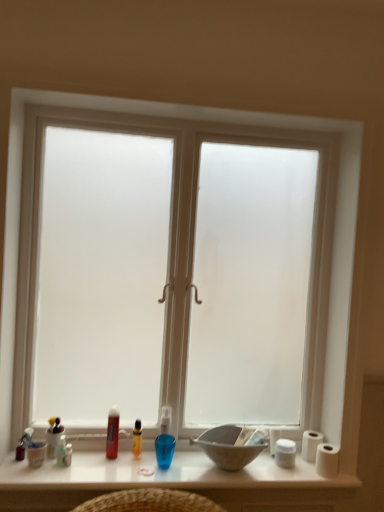
Question: Is matte white cup at lower left, placed as the 2th toiletry when sorted from left to right, completely or partially outside of white matte toilet paper at right, the first toilet paper positioned from the front?

Choices:
 (A) no
 (B) yes

Answer: (B)

Question: Is matte white cup at lower left, the 4th toiletry viewed from the right, not near white matte toilet paper at right, the first toilet paper positioned from the front?

Choices:
 (A) yes
 (B) no

Answer: (A)

Question: Is matte white cup at lower left, the 4th toiletry viewed from the right, facing away from white matte toilet paper at right, placed as the second toilet paper when sorted from back to front?

Choices:
 (A) yes
 (B) no

Answer: (B)

Question: Are matte white cup at lower left, the 4th toiletry viewed from the right, and white matte toilet paper at right, the first toilet paper positioned from the front, beside each other?

Choices:
 (A) yes
 (B) no

Answer: (B)

Question: Is matte white cup at lower left, the 4th toiletry viewed from the right, smaller than white matte toilet paper at right, placed as the second toilet paper when sorted from back to front?

Choices:
 (A) no
 (B) yes

Answer: (B)

Question: Considering their positions, is matte gray bowl at center located in front of or behind translucent plastic bottle at lower left, which is counted as the 3th toiletry, starting from the left?

Choices:
 (A) front
 (B) behind

Answer: (A)

Question: Considering the positions of matte gray bowl at center and translucent plastic bottle at lower left, which appears as the third toiletry when viewed from the right, in the image, is matte gray bowl at center bigger or smaller than translucent plastic bottle at lower left, which appears as the third toiletry when viewed from the right,?

Choices:
 (A) big
 (B) small

Answer: (A)

Question: From a real-world perspective, is matte gray bowl at center physically located above or below translucent plastic bottle at lower left, which appears as the third toiletry when viewed from the right?

Choices:
 (A) below
 (B) above

Answer: (B)

Question: Is matte gray bowl at center taller or shorter than translucent plastic bottle at lower left, which appears as the third toiletry when viewed from the right?

Choices:
 (A) tall
 (B) short

Answer: (A)

Question: From their relative heights in the image, would you say matte white cup at lower left, the 4th toiletry viewed from the right, is taller or shorter than translucent plastic bottle at lower left, which is counted as the 3th toiletry, starting from the left?

Choices:
 (A) short
 (B) tall

Answer: (B)

Question: Relative to translucent plastic bottle at lower left, which appears as the third toiletry when viewed from the right, is matte white cup at lower left, the 4th toiletry viewed from the right, in front or behind?

Choices:
 (A) behind
 (B) front

Answer: (A)

Question: From the image's perspective, is matte white cup at lower left, the 4th toiletry viewed from the right, positioned above or below translucent plastic bottle at lower left, which appears as the third toiletry when viewed from the right?

Choices:
 (A) above
 (B) below

Answer: (A)

Question: Considering the positions of matte white cup at lower left, the 4th toiletry viewed from the right, and translucent plastic bottle at lower left, which appears as the third toiletry when viewed from the right, in the image, is matte white cup at lower left, the 4th toiletry viewed from the right, bigger or smaller than translucent plastic bottle at lower left, which appears as the third toiletry when viewed from the right,?

Choices:
 (A) big
 (B) small

Answer: (A)

Question: Considering the positions of point (135, 454) and point (59, 463), is point (135, 454) closer or farther from the camera than point (59, 463)?

Choices:
 (A) farther
 (B) closer

Answer: (A)

Question: From a real-world perspective, is translucent plastic bottle at center, marked as the fifth toiletry in a left-to-right arrangement, positioned above or below matte white cup at lower left, the 4th toiletry viewed from the right?

Choices:
 (A) below
 (B) above

Answer: (B)